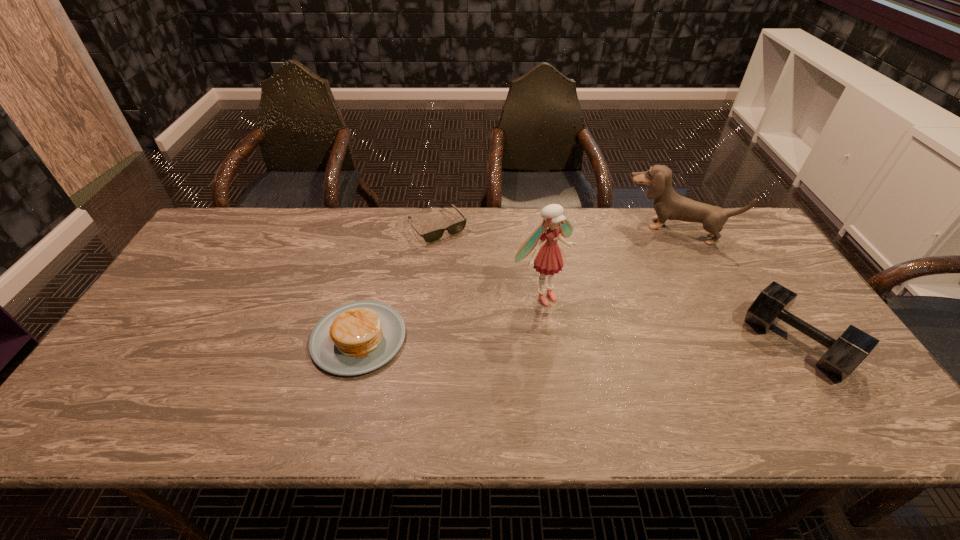
Where is `free space between the doll and the dumbbell`? The image size is (960, 540). free space between the doll and the dumbbell is located at coordinates (668, 319).

Find the location of a particular element. This screenshot has height=540, width=960. vacant space that's between the second shortest object and the shortest object is located at coordinates (398, 282).

The width and height of the screenshot is (960, 540). I want to click on blank region between the puppy and the dumbbell, so click(735, 286).

Identify the location of free space between the second shortest object and the third shortest object. Image resolution: width=960 pixels, height=540 pixels. (577, 341).

At what (x,y) coordinates should I click in order to perform the action: click on vacant area that lies between the fourth shortest object and the dumbbell. Please return your answer as a coordinate pair (x, y). The height and width of the screenshot is (540, 960). Looking at the image, I should click on (735, 286).

What are the coordinates of `unoccupied position between the fourth tallest object and the fourth shortest object` in the screenshot? It's located at (516, 284).

Where is `vacant space in between the third tallest object and the puppy`? The width and height of the screenshot is (960, 540). vacant space in between the third tallest object and the puppy is located at coordinates (735, 286).

Find the location of a particular element. This screenshot has width=960, height=540. vacant point located between the third shortest object and the puppy is located at coordinates (735, 286).

Locate an element on the screen. object that can be found as the closest to the tallest object is located at coordinates (434, 235).

Locate which object is the third closest to the puppy. Please provide its 2D coordinates. Your answer should be formatted as a tuple, i.e. [(x, y)], where the tuple contains the x and y coordinates of a point satisfying the conditions above.

[(434, 235)]